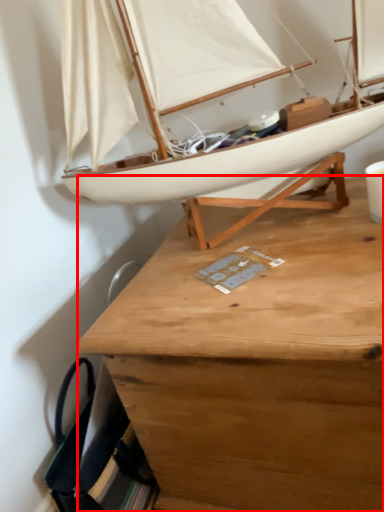
Question: From the image, what is the correct spatial relationship of desk (annotated by the red box) in relation to boat?

Choices:
 (A) left
 (B) right

Answer: (B)